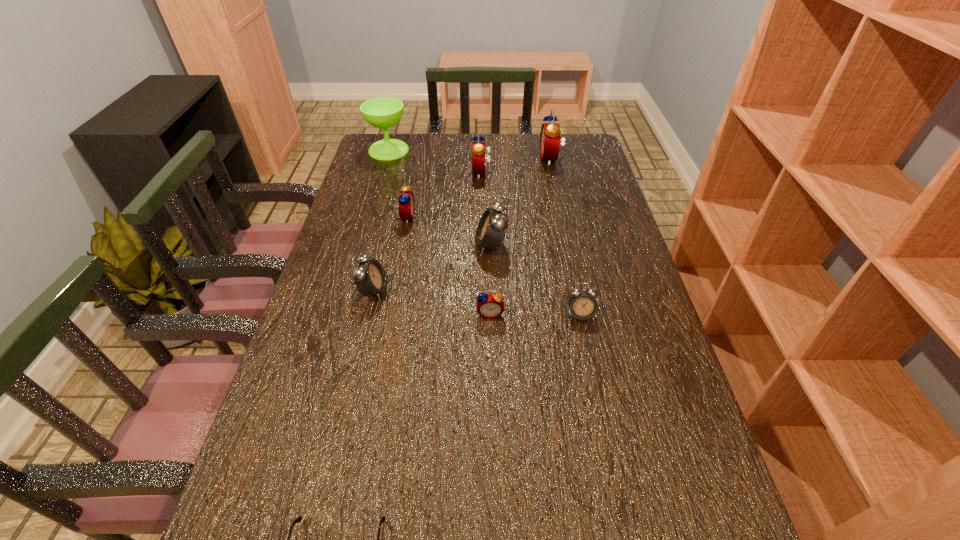
Locate an element on the screen. object that stands as the closest to the second smallest white alarm clock is located at coordinates (406, 204).

Find the location of a particular element. The image size is (960, 540). the third closest object to the tallest alarm clock is located at coordinates (406, 204).

Where is `alarm clock that stands as the fourth closest to the smallest white alarm clock`? alarm clock that stands as the fourth closest to the smallest white alarm clock is located at coordinates (406, 204).

At what (x,y) coordinates should I click in order to perform the action: click on the seventh closest alarm clock to the spectacles. Please return your answer as a coordinate pair (x, y). The height and width of the screenshot is (540, 960). Looking at the image, I should click on (550, 133).

Identify the location of red alarm clock that can be found as the third closest to the nearest red alarm clock. (550, 133).

Find the location of `the second closest red alarm clock relative to the nearest white alarm clock`. the second closest red alarm clock relative to the nearest white alarm clock is located at coordinates (406, 204).

Locate an element on the screen. This screenshot has width=960, height=540. the closest white alarm clock to the nearest red alarm clock is located at coordinates (582, 303).

The width and height of the screenshot is (960, 540). I want to click on the second closest white alarm clock to the spectacles, so click(582, 303).

The image size is (960, 540). In order to click on free space that satisfies the following two spatial constraints: 1. on the front-facing side of the rightmost red alarm clock; 2. on the front-facing side of the smallest red alarm clock in this screenshot , I will do `click(585, 314)`.